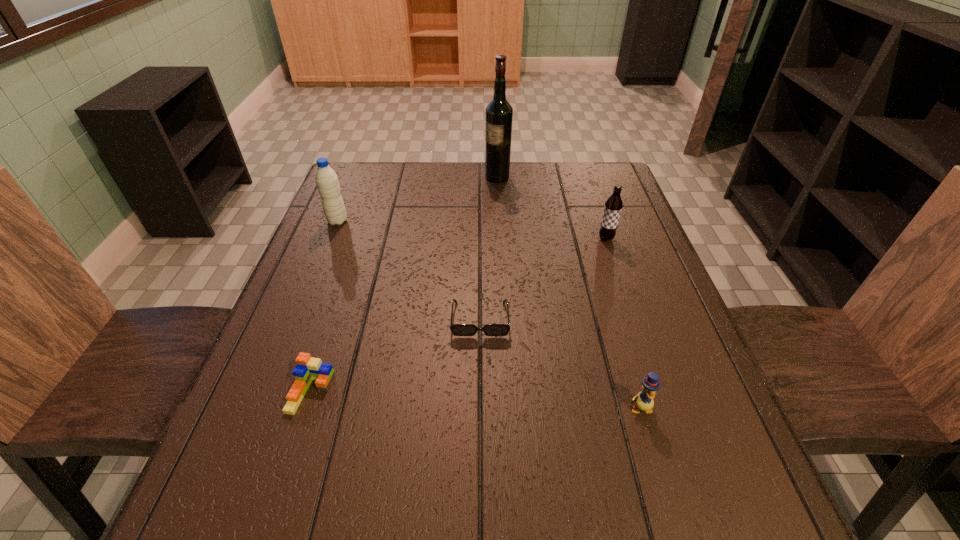
The image size is (960, 540). Find the location of `the farthest object`. the farthest object is located at coordinates (499, 113).

This screenshot has height=540, width=960. In order to click on the tallest object in this screenshot , I will do `click(499, 113)`.

Locate an element on the screen. This screenshot has height=540, width=960. the leftmost object is located at coordinates (326, 179).

Identify the location of the second farthest object. The height and width of the screenshot is (540, 960). (326, 179).

Where is `root beer`? The image size is (960, 540). root beer is located at coordinates (613, 206).

The width and height of the screenshot is (960, 540). I want to click on the fourth shortest object, so click(613, 206).

Find the location of a particular element. Image resolution: width=960 pixels, height=540 pixels. the third shortest object is located at coordinates (643, 400).

This screenshot has width=960, height=540. I want to click on Lego, so click(308, 368).

This screenshot has height=540, width=960. I want to click on the second shortest object, so click(308, 368).

Locate an element on the screen. This screenshot has height=540, width=960. sunglasses is located at coordinates (457, 329).